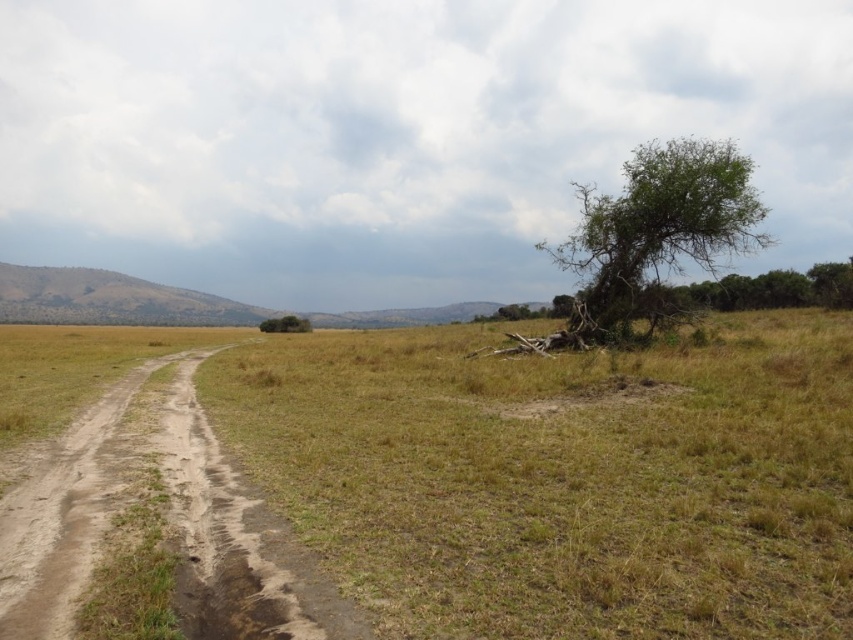
You are a hiker trying to navigate the savanna. You see the dry grass at center and the green leafy tree at upper right. Which of these two landmarks is taller?

The green leafy tree at upper right is taller than the dry grass at center.

You are a hiker lost in the savanna and see the dry grass at center and the green leafy tree at center. Which direction should you walk to reach the tree from the grass?

The dry grass at center is to the right of the green leafy tree at center, so you should walk to the left to reach the tree from the grass.